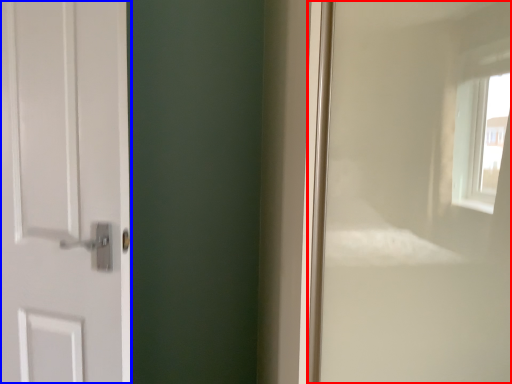
Question: Which object appears farthest to the camera in this image, window frame (highlighted by a red box) or door (highlighted by a blue box)?

Choices:
 (A) window frame
 (B) door

Answer: (B)